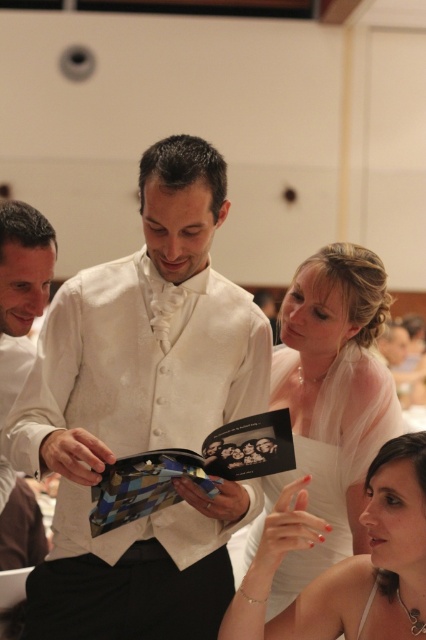
You are a photographer at the event and want to capture a photo of both the white satin dress at center and the white satin dress at lower right. Which dress should you focus on first to ensure it appears larger in the photo?

The white satin dress at center should be focused on first because it has a greater height compared to the white satin dress at lower right, making it appear larger in the photo.

You are standing at the center of the image and want to move towards the point marked as point (331, 401). Is this point located to your left or right side?

The point (331, 401) corresponds to the white satin dress at center, so it is directly in front of you.

You are a photographer at the event and need to capture a photo of both the white satin suit at center and the white satin dress at center. Which one is positioned higher in the frame?

The white satin suit at center is positioned higher in the frame than the white satin dress at center.